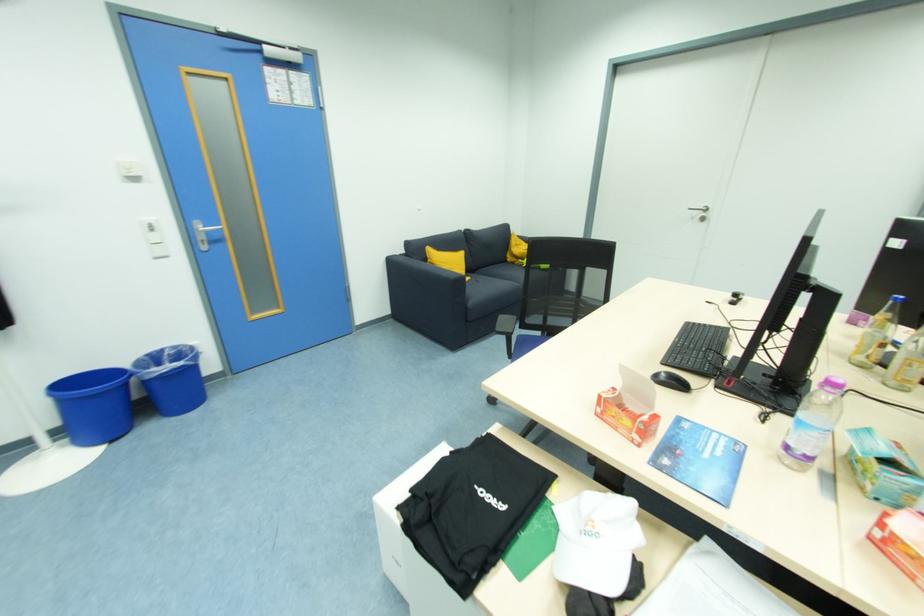
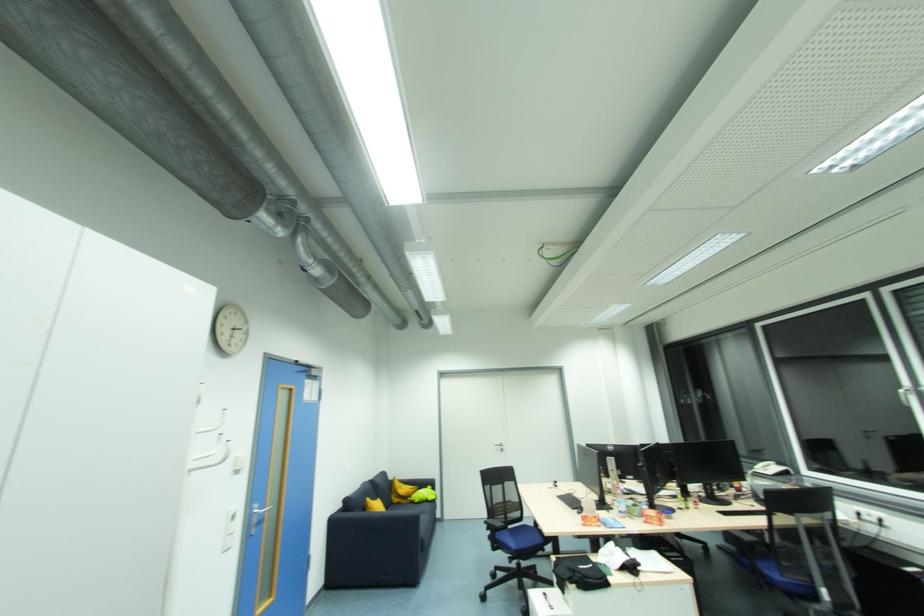
Locate, in the second image, the point that corresponds to point (154, 230) in the first image.

(236, 520)